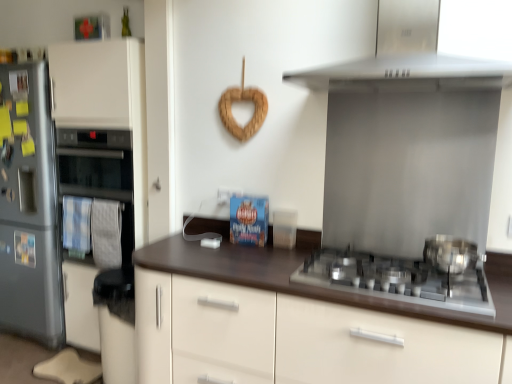
Question: Is satin silver gas stove at lower right closer to the viewer compared to polished stainless steel pot at right?

Choices:
 (A) yes
 (B) no

Answer: (A)

Question: Is satin silver gas stove at lower right bigger than polished stainless steel pot at right?

Choices:
 (A) yes
 (B) no

Answer: (A)

Question: Can polished stainless steel pot at right be found inside satin silver gas stove at lower right?

Choices:
 (A) no
 (B) yes

Answer: (A)

Question: Is satin silver gas stove at lower right facing away from polished stainless steel pot at right?

Choices:
 (A) no
 (B) yes

Answer: (A)

Question: Considering the relative sizes of satin silver gas stove at lower right and polished stainless steel pot at right in the image provided, is satin silver gas stove at lower right thinner than polished stainless steel pot at right?

Choices:
 (A) yes
 (B) no

Answer: (B)

Question: In terms of width, does satin white oven at left look wider or thinner when compared to satin silver fridge at left?

Choices:
 (A) wide
 (B) thin

Answer: (B)

Question: From a real-world perspective, relative to satin silver fridge at left, is satin white oven at left vertically above or below?

Choices:
 (A) above
 (B) below

Answer: (A)

Question: Considering their positions, is satin white oven at left located in front of or behind satin silver fridge at left?

Choices:
 (A) front
 (B) behind

Answer: (A)

Question: Is satin white oven at left taller or shorter than satin silver fridge at left?

Choices:
 (A) tall
 (B) short

Answer: (A)

Question: In terms of size, does brown matte countertop at center appear bigger or smaller than satin silver gas stove at lower right?

Choices:
 (A) small
 (B) big

Answer: (B)

Question: From a real-world perspective, is brown matte countertop at center physically located above or below satin silver gas stove at lower right?

Choices:
 (A) above
 (B) below

Answer: (B)

Question: Looking at their shapes, would you say brown matte countertop at center is wider or thinner than satin silver gas stove at lower right?

Choices:
 (A) thin
 (B) wide

Answer: (B)

Question: Is brown matte countertop at center spatially inside satin silver gas stove at lower right, or outside of it?

Choices:
 (A) inside
 (B) outside

Answer: (B)

Question: In terms of height, does brown matte countertop at center look taller or shorter compared to stainless steel range hood at upper center?

Choices:
 (A) short
 (B) tall

Answer: (B)

Question: Does point (501, 309) appear closer or farther from the camera than point (343, 76)?

Choices:
 (A) closer
 (B) farther

Answer: (A)